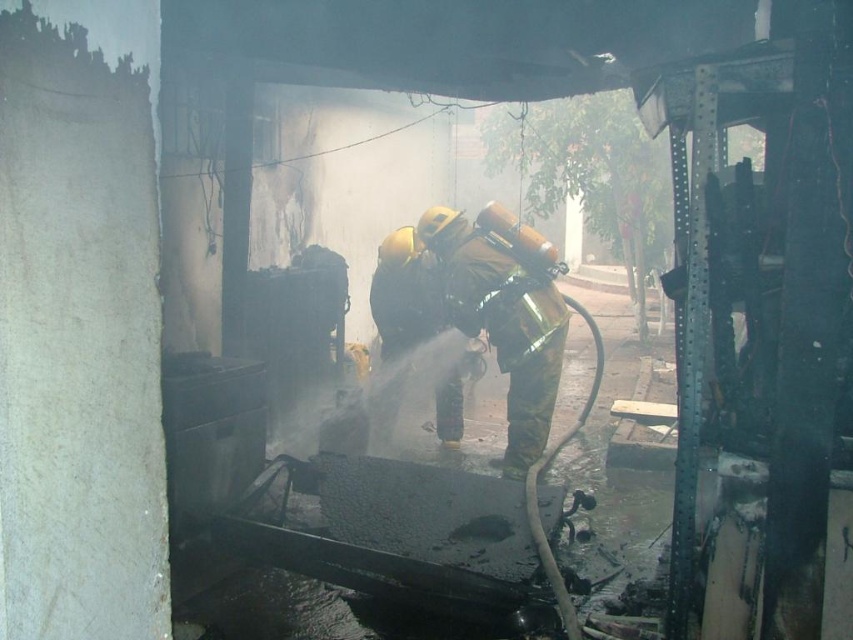
Question: Is camouflage fabric fireman at center to the left of shiny gold helmet at center from the viewer's perspective?

Choices:
 (A) yes
 (B) no

Answer: (B)

Question: Can you confirm if camouflage fabric fireman at center is bigger than shiny gold helmet at center?

Choices:
 (A) yes
 (B) no

Answer: (A)

Question: Which of the following is the farthest from the observer?

Choices:
 (A) (408, 321)
 (B) (503, 209)

Answer: (A)

Question: Does camouflage fabric fireman at center appear under shiny gold helmet at center?

Choices:
 (A) no
 (B) yes

Answer: (B)

Question: Which point appears closest to the camera in this image?

Choices:
 (A) (457, 280)
 (B) (386, 260)

Answer: (A)

Question: Among these points, which one is farthest from the camera?

Choices:
 (A) (459, 212)
 (B) (393, 317)

Answer: (B)